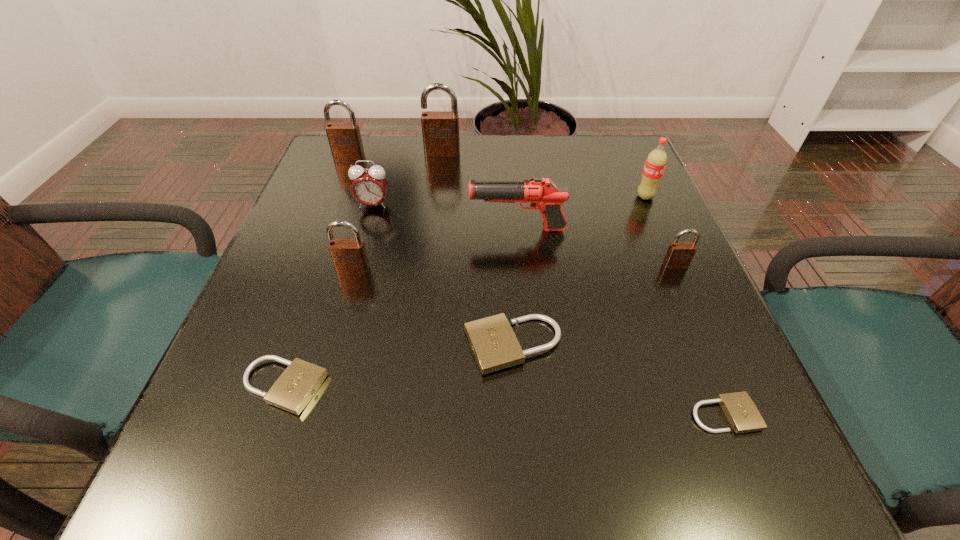
Where is `vacant point located between the red soda and the gun`? The height and width of the screenshot is (540, 960). vacant point located between the red soda and the gun is located at coordinates (582, 213).

The height and width of the screenshot is (540, 960). What are the coordinates of `vacant area between the fifth farthest object and the pink alarm clock` in the screenshot? It's located at point(445,217).

In order to click on vacant area that lies between the second brown padlock from left to right and the black gun in this screenshot , I will do pos(436,250).

Identify the location of free spot between the sixth shortest padlock and the smallest beige padlock. This screenshot has height=540, width=960. (537, 286).

Where is `vacant space that's between the fourth shortest object and the gun`? This screenshot has width=960, height=540. vacant space that's between the fourth shortest object and the gun is located at coordinates (596, 247).

You are a GUI agent. You are given a task and a screenshot of the screen. Output one action in this format:
    pyautogui.click(x=<x>, y=<y>)
    Task: Click on the free space between the biggest beige padlock and the biggest brown padlock
    
    Given the screenshot: What is the action you would take?
    click(478, 249)

What are the coordinates of `empty location between the leftmost brown padlock and the shortest padlock` in the screenshot? It's located at (537, 286).

Where is `object that is the sixth closest to the biggest beige padlock`? object that is the sixth closest to the biggest beige padlock is located at coordinates (369, 186).

Locate an element on the screen. Image resolution: width=960 pixels, height=540 pixels. object that is the second closest to the tallest padlock is located at coordinates (369, 186).

What are the coordinates of `padlock that is the closest to the leftmost brown padlock` in the screenshot? It's located at (440, 129).